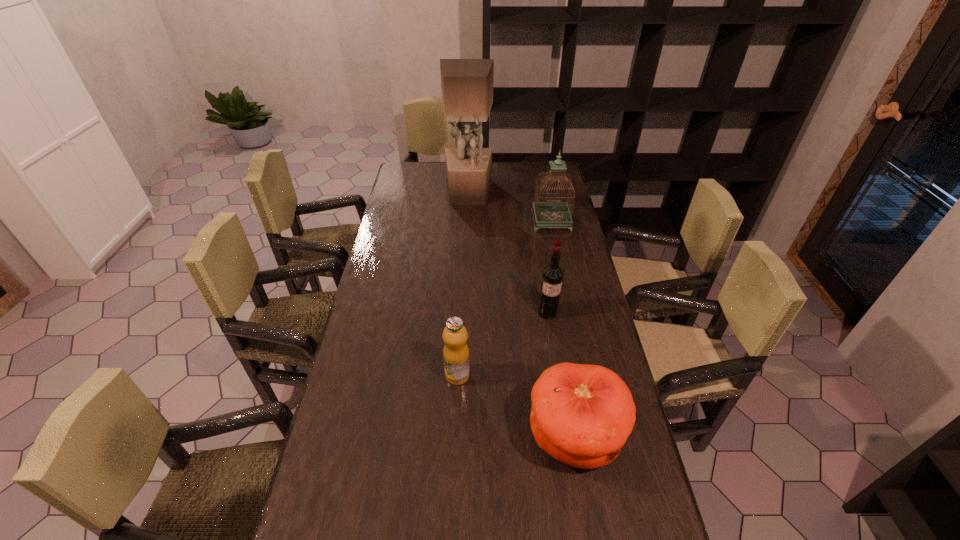
Find the location of a particular element. the tallest object is located at coordinates (467, 84).

I want to click on the farthest object, so coord(467,84).

Locate an element on the screen. The image size is (960, 540). the second farthest object is located at coordinates (553, 213).

Locate an element on the screen. wine bottle is located at coordinates (552, 277).

At what (x,y) coordinates should I click in order to perform the action: click on fruit juice. Please return your answer as a coordinate pair (x, y). Looking at the image, I should click on click(x=456, y=352).

Image resolution: width=960 pixels, height=540 pixels. Identify the location of the nearest object. (581, 415).

I want to click on vacant space located on the front-facing side of the farthest object, so click(x=468, y=222).

Find the location of a particular element. free region located at the door of the birdcage is located at coordinates (565, 292).

Find the location of a particular element. free space located 0.310m on the front and back of the wine bottle is located at coordinates (562, 404).

This screenshot has height=540, width=960. Find the location of `vacant position located on the front label of the fourth farthest object`. vacant position located on the front label of the fourth farthest object is located at coordinates (451, 505).